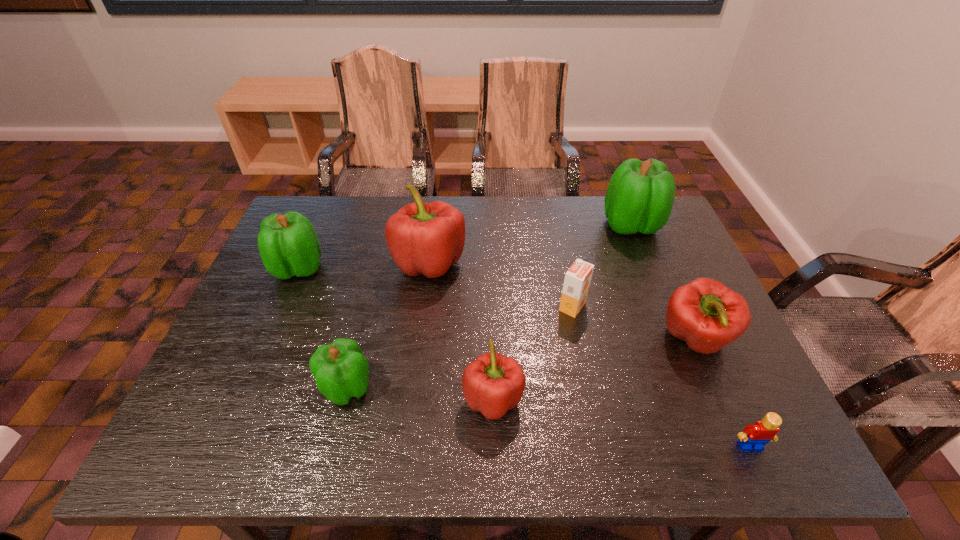
Identify the location of free space located on the back of the orange juice. The width and height of the screenshot is (960, 540). (564, 262).

What are the coordinates of `free space located on the left of the second green bell pepper from left to right` in the screenshot? It's located at (275, 387).

Locate an element on the screen. The image size is (960, 540). blank space located on the back of the smallest pink bell pepper is located at coordinates (491, 298).

Find the location of a particular element. This screenshot has height=540, width=960. bell pepper present at the near edge is located at coordinates pyautogui.click(x=492, y=384).

Locate an element on the screen. This screenshot has width=960, height=540. Lego at the near edge is located at coordinates (754, 437).

The height and width of the screenshot is (540, 960). What are the coordinates of `object situated at the left edge` in the screenshot? It's located at (288, 244).

What are the coordinates of `Lego present at the right edge` in the screenshot? It's located at (754, 437).

Where is `object present at the far right corner`? object present at the far right corner is located at coordinates (639, 198).

At what (x,y) coordinates should I click in order to perform the action: click on object that is at the near right corner. Please return your answer as a coordinate pair (x, y). This screenshot has height=540, width=960. Looking at the image, I should click on (754, 437).

I want to click on free region at the far edge of the desktop, so click(480, 240).